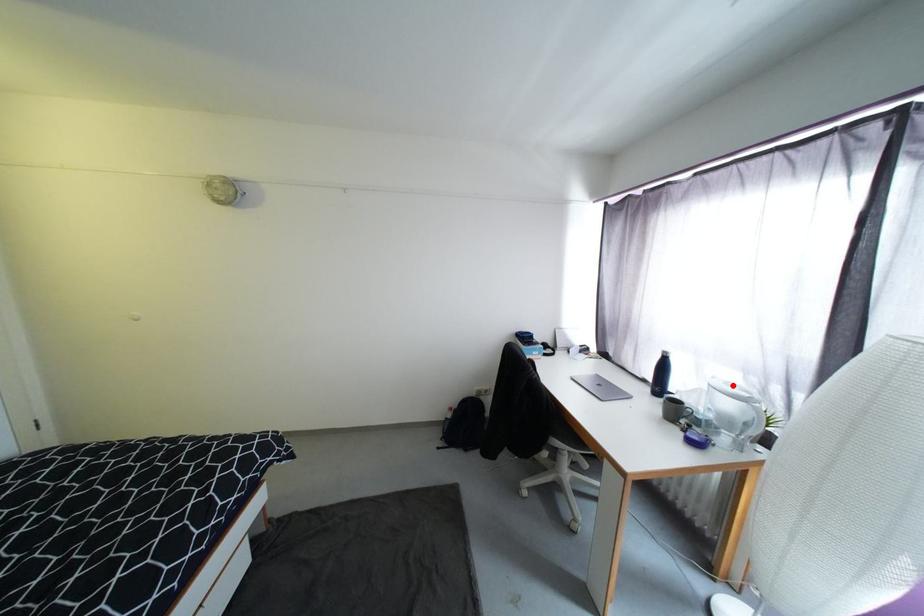
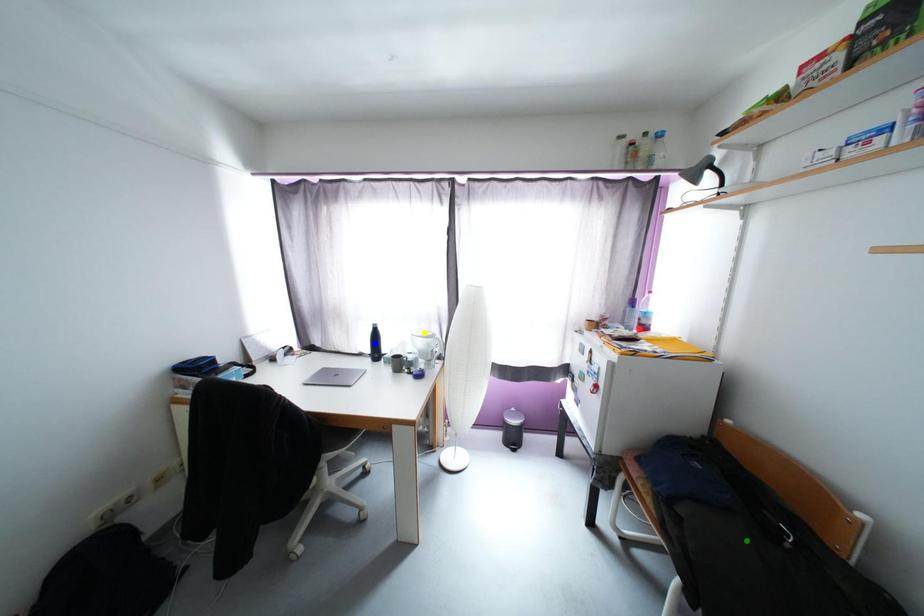
Question: I am providing you with two images of the same scene from different viewpoints. A red point is marked on the first image. You are given multiple points on the second image. In image 2, which mark is for the same physical point as the one in image 1?

Choices:
 (A) green point
 (B) yellow point
 (C) blue point

Answer: (B)